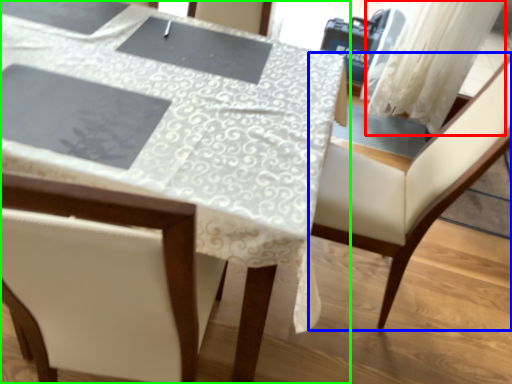
Question: Which object is positioned farthest from curtain (highlighted by a red box)? Select from chair (highlighted by a blue box) and table (highlighted by a green box).

Choices:
 (A) chair
 (B) table

Answer: (B)